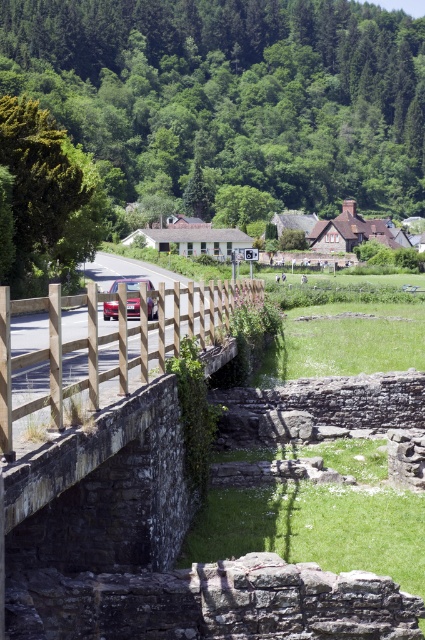
You are a pedestrian standing on the stone bridge at center and want to get to the metallic pink car at center. Which direction should you walk to reach it?

The stone bridge at center is below the metallic pink car at center, so you should walk upwards to reach the metallic pink car at center.

You are standing at the starting point of the road and want to reach the stone bridge at center. Which direction should you head towards?

Since the stone bridge at center is located at coordinates point (104, 492), you should head towards the direction where the coordinates increase in the x and y axes to reach it.